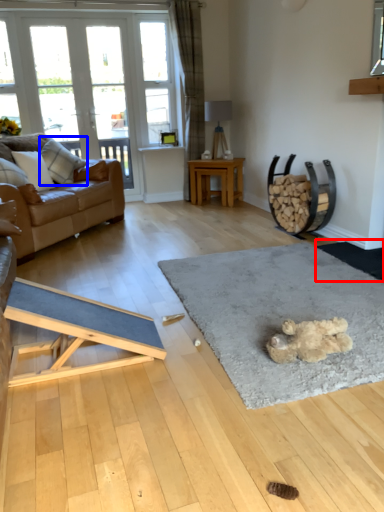
Question: Which object appears closest to the camera in this image, doormat (highlighted by a red box) or pillow (highlighted by a blue box)?

Choices:
 (A) doormat
 (B) pillow

Answer: (A)